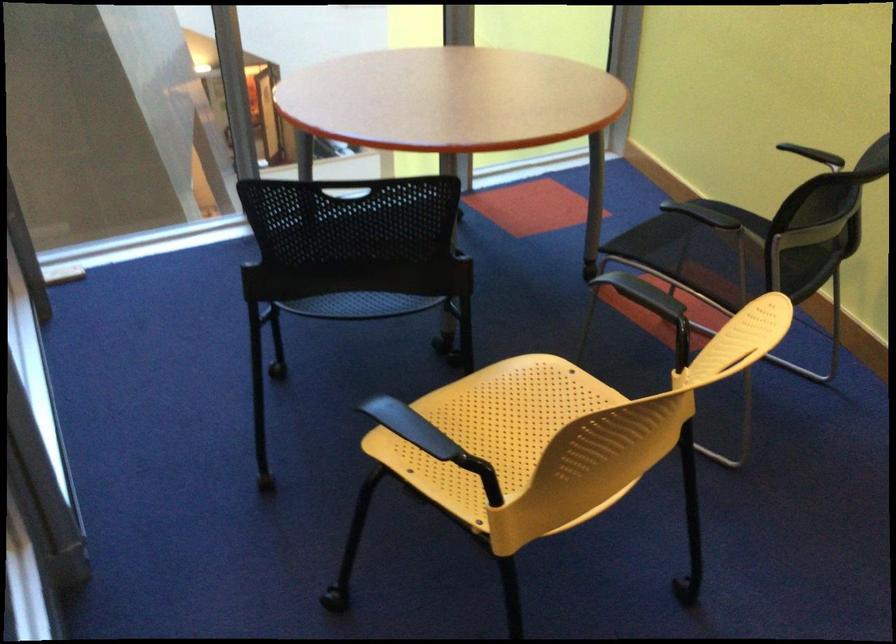
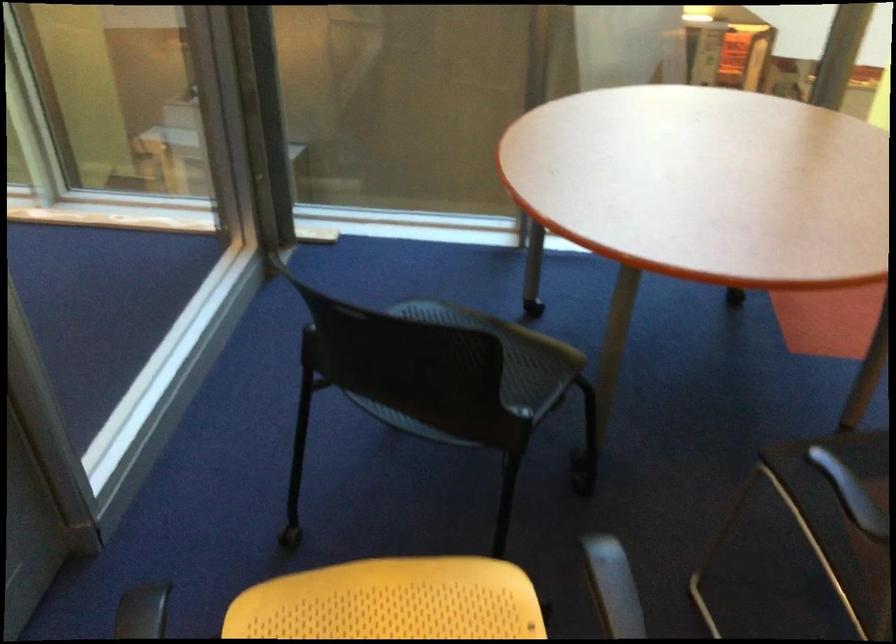
Question: The images are taken continuously from a first-person perspective. In which direction is your viewpoint rotating?

Choices:
 (A) Left
 (B) Right
 (C) Up
 (D) Down

Answer: (A)